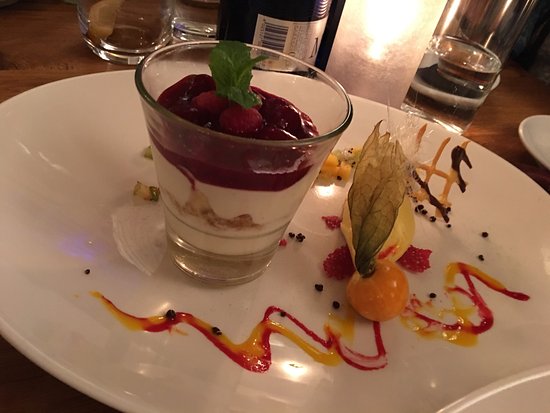
Where is `glass`? This screenshot has height=413, width=550. glass is located at coordinates (495, 36).